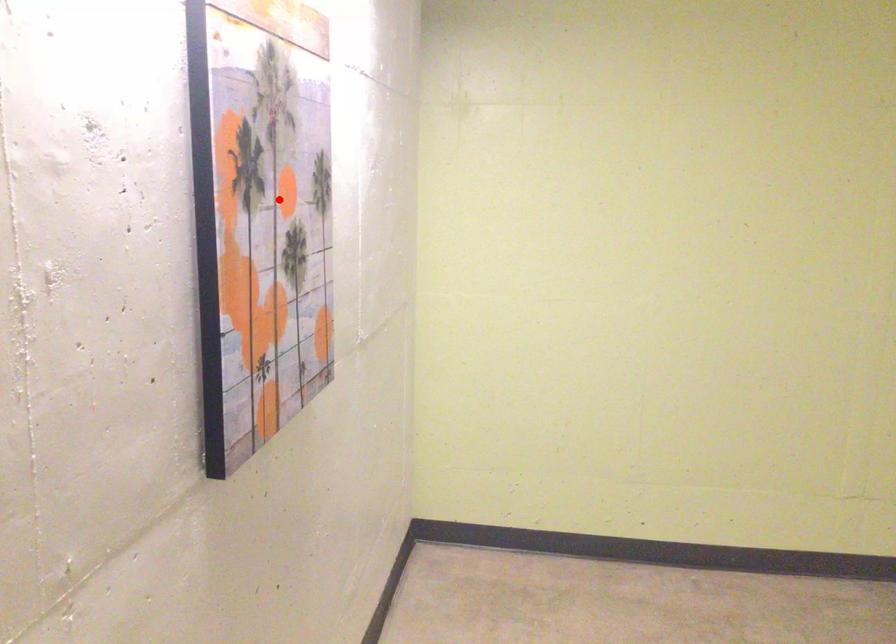
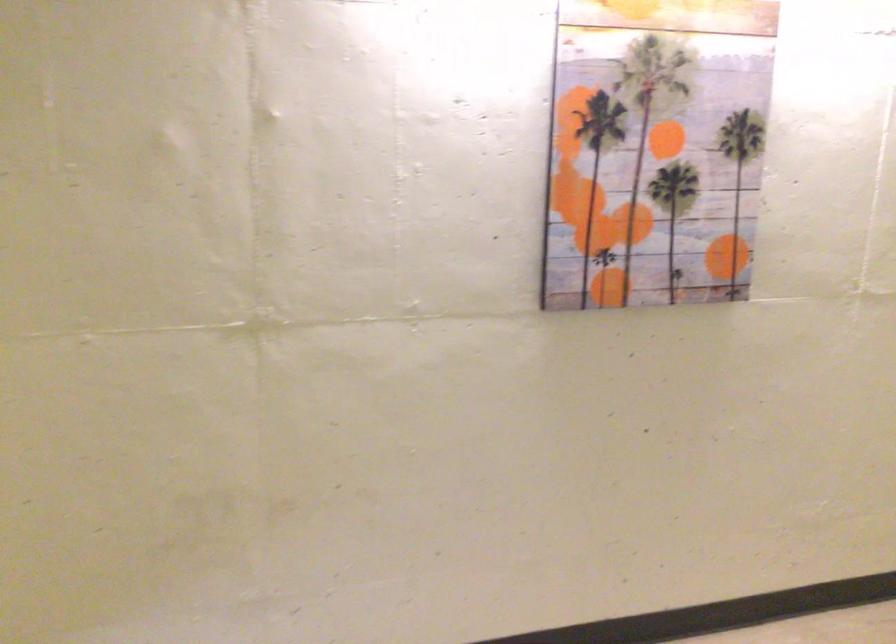
In the second image, find the point that corresponds to the highlighted location in the first image.

(655, 149)